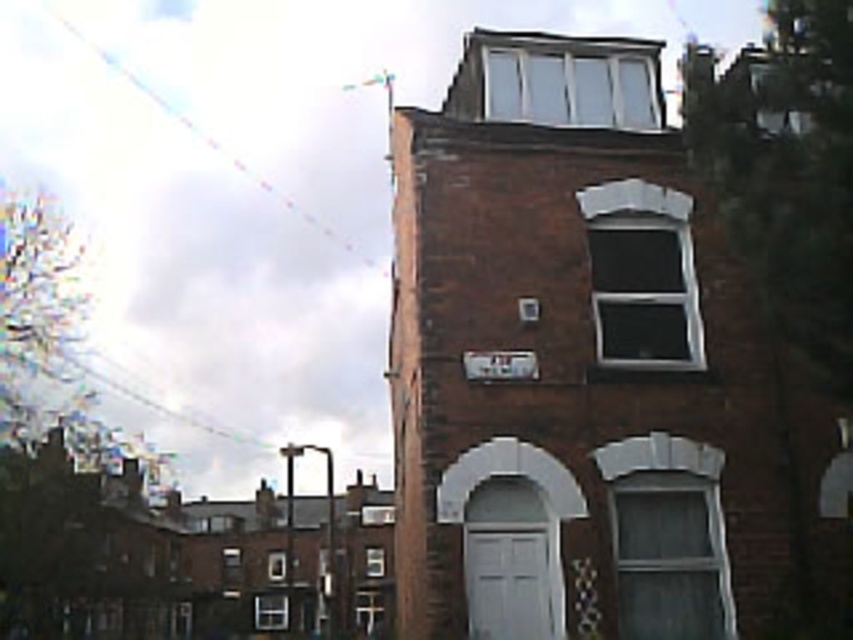
Question: Does brown brick building at center have a lesser width compared to transparent plastic kite at upper left?

Choices:
 (A) no
 (B) yes

Answer: (B)

Question: Which object appears closest to the camera in this image?

Choices:
 (A) transparent plastic kite at upper left
 (B) brown brick building at center

Answer: (B)

Question: Which of the following is the closest to the observer?

Choices:
 (A) (314, 216)
 (B) (468, 616)

Answer: (B)

Question: Is brown brick building at center positioned at the back of transparent plastic kite at upper left?

Choices:
 (A) no
 (B) yes

Answer: (A)

Question: Is brown brick building at center below transparent plastic kite at upper left?

Choices:
 (A) no
 (B) yes

Answer: (B)